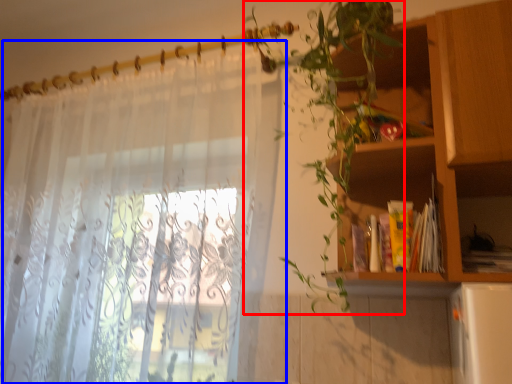
Question: Among these objects, which one is farthest to the camera, vegetation (highlighted by a red box) or curtain (highlighted by a blue box)?

Choices:
 (A) vegetation
 (B) curtain

Answer: (B)